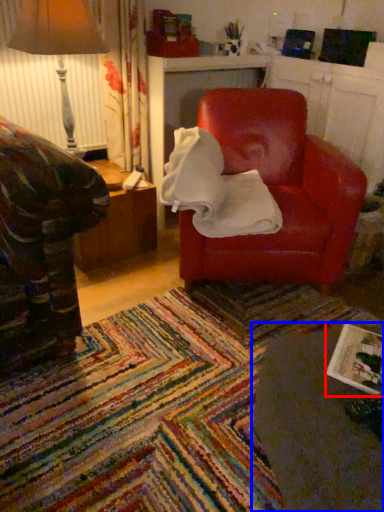
Question: Which object appears closest to the camera in this image, magazine (highlighted by a red box) or table (highlighted by a blue box)?

Choices:
 (A) magazine
 (B) table

Answer: (B)